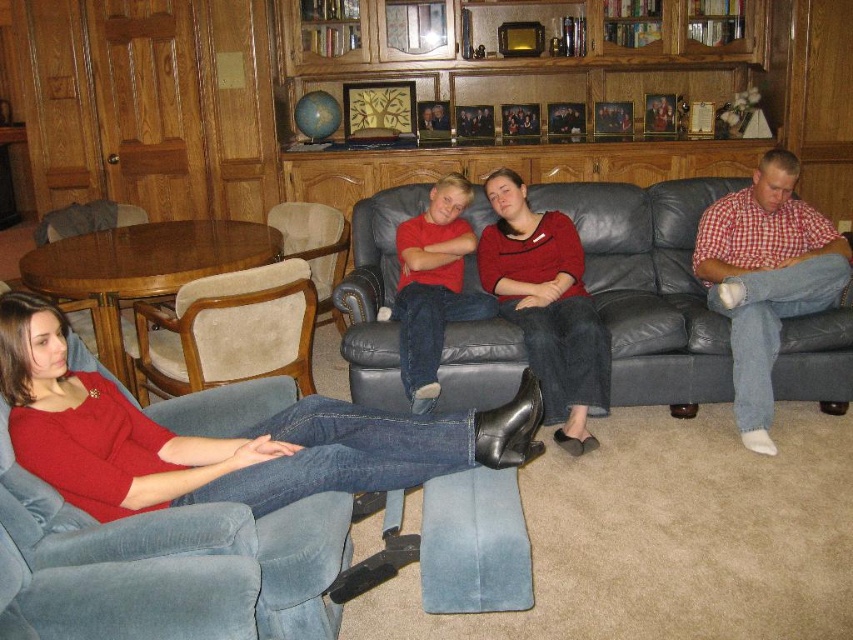
Does matte red sweater at lower left have a greater width compared to red checkered shirt at right?

Correct, the width of matte red sweater at lower left exceeds that of red checkered shirt at right.

Is matte red sweater at lower left below red checkered shirt at right?

Yes, matte red sweater at lower left is below red checkered shirt at right.

Which is behind, point (102, 474) or point (746, 390)?

Point (746, 390)

I want to click on matte red sweater at lower left, so click(222, 438).

Between point (798, 387) and point (334, 275), which one is positioned in front?

Point (798, 387)

Between leather couch at center and beige fabric armchair at center, which one is positioned lower?

beige fabric armchair at center

Identify the location of leather couch at center. (650, 285).

Does matte red sweater at lower left appear over matte red sweater at center?

No.

Who is positioned more to the right, matte red sweater at lower left or matte red sweater at center?

Positioned to the right is matte red sweater at center.

Locate an element on the screen. The height and width of the screenshot is (640, 853). matte red sweater at lower left is located at coordinates (222, 438).

Image resolution: width=853 pixels, height=640 pixels. What are the coordinates of `matte red sweater at lower left` in the screenshot? It's located at (222, 438).